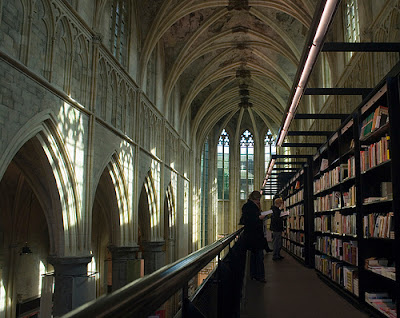
This screenshot has width=400, height=318. I want to click on lighting on books, so click(321, 33), click(307, 66), click(293, 107), click(285, 124), click(282, 136), click(273, 158), click(267, 173), click(265, 182), click(263, 188).